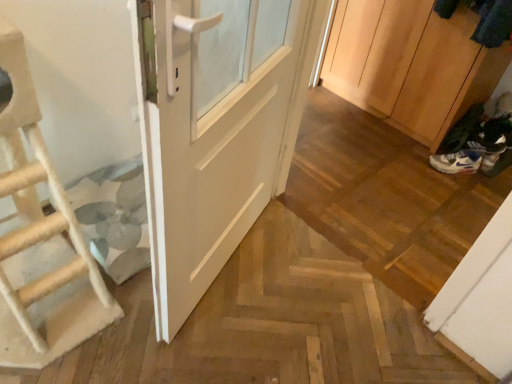
The width and height of the screenshot is (512, 384). Find the location of `vacant space in front of white mesh shoe at lower right`. vacant space in front of white mesh shoe at lower right is located at coordinates (460, 187).